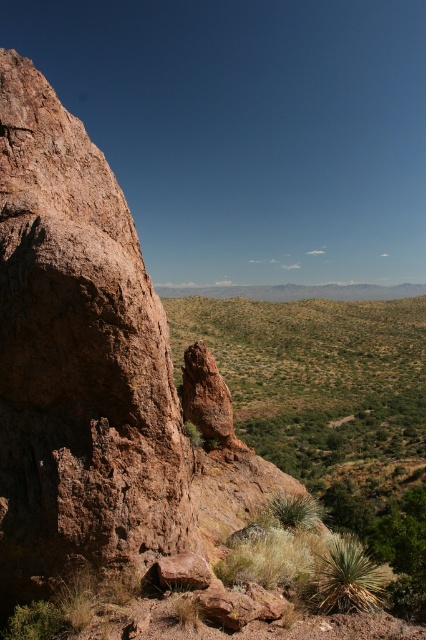
Question: Which of the following is the farthest from the observer?

Choices:
 (A) brown rough rock at left
 (B) green leafy shrubs at center

Answer: (B)

Question: Is brown rough rock at left wider than green leafy shrubs at center?

Choices:
 (A) yes
 (B) no

Answer: (B)

Question: Among these objects, which one is farthest from the camera?

Choices:
 (A) brown rough rock at left
 (B) green leafy shrubs at center

Answer: (B)

Question: Observing the image, what is the correct spatial positioning of brown rough rock at left in reference to green leafy shrubs at center?

Choices:
 (A) above
 (B) below

Answer: (B)

Question: Does brown rough rock at left have a greater width compared to green leafy shrubs at center?

Choices:
 (A) no
 (B) yes

Answer: (A)